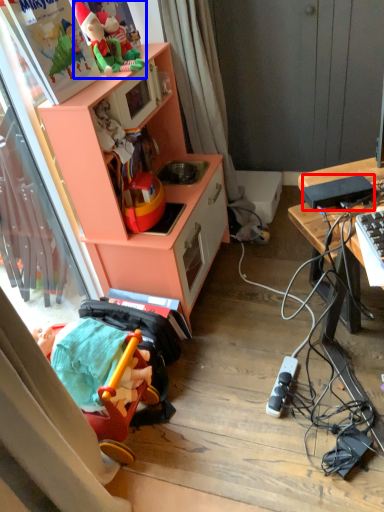
Question: Among these objects, which one is nearest to the camera, appliance (highlighted by a red box) or toy (highlighted by a blue box)?

Choices:
 (A) appliance
 (B) toy

Answer: (A)